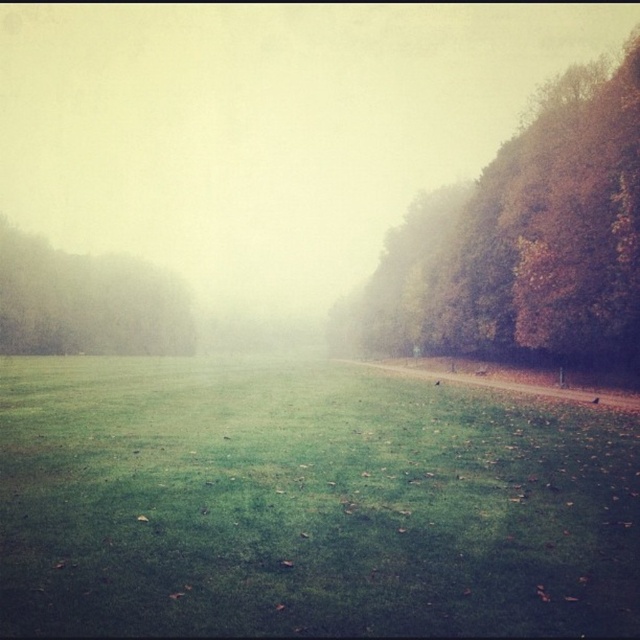
Can you confirm if autumn leaves at right is shorter than green matte tree at left?

No.

Which is more to the right, autumn leaves at right or green matte tree at left?

autumn leaves at right

What do you see at coordinates (524, 241) in the screenshot? I see `autumn leaves at right` at bounding box center [524, 241].

Find the location of a particular element. This screenshot has width=640, height=640. autumn leaves at right is located at coordinates (524, 241).

Consider the image. Is green grassy field at center below green matte tree at left?

Yes, green grassy field at center is below green matte tree at left.

Does green grassy field at center have a greater height compared to green matte tree at left?

In fact, green grassy field at center may be shorter than green matte tree at left.

What do you see at coordinates (307, 502) in the screenshot?
I see `green grassy field at center` at bounding box center [307, 502].

This screenshot has width=640, height=640. I want to click on green grassy field at center, so click(307, 502).

Can you confirm if green grassy field at center is shorter than autumn leaves at right?

Yes, green grassy field at center is shorter than autumn leaves at right.

Who is more forward, (x=33, y=419) or (x=429, y=352)?

Point (x=33, y=419) is more forward.

I want to click on green grassy field at center, so click(x=307, y=502).